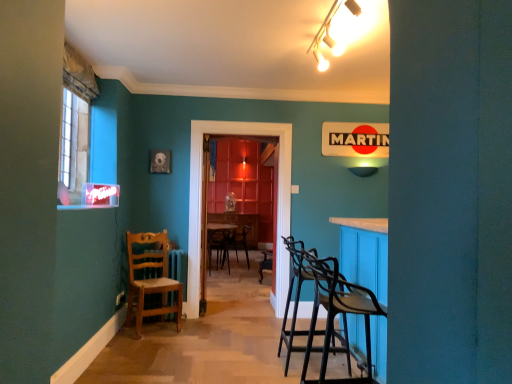
This screenshot has width=512, height=384. What are the coordinates of `free space in front of wooden chair at left` in the screenshot? It's located at (146, 339).